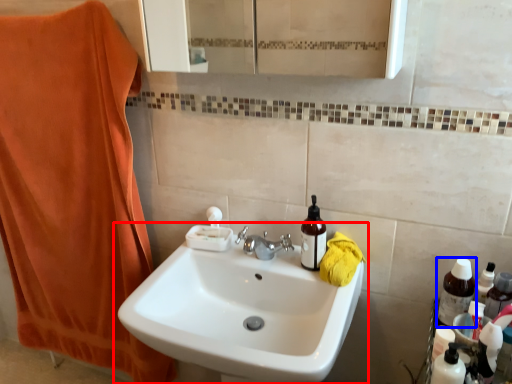
Question: Among these objects, which one is farthest to the camera, sink (highlighted by a red box) or bottle (highlighted by a blue box)?

Choices:
 (A) sink
 (B) bottle

Answer: (B)